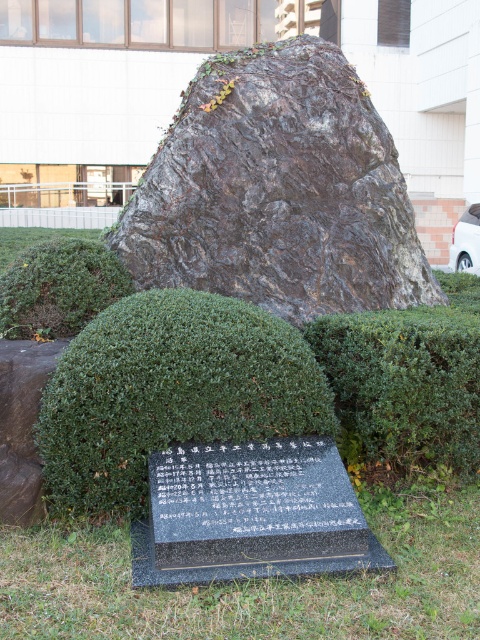
Question: Can you confirm if green grass at lower center is thinner than black granite stone at center?

Choices:
 (A) no
 (B) yes

Answer: (A)

Question: Which object is closer to the camera taking this photo?

Choices:
 (A) black granite stone at center
 (B) dark brown rock at center
 (C) green grass at lower center

Answer: (C)

Question: In this image, where is green shrubbery at center located relative to black granite stone at center?

Choices:
 (A) right
 (B) left

Answer: (B)

Question: Among these objects, which one is farthest from the camera?

Choices:
 (A) green grass at lower center
 (B) green shrubbery at center

Answer: (B)

Question: Can you confirm if green grass at lower center is positioned above black granite stone at center?

Choices:
 (A) yes
 (B) no

Answer: (B)

Question: Which object is farther from the camera taking this photo?

Choices:
 (A) black granite stone at center
 (B) green leafy hedge at center

Answer: (B)